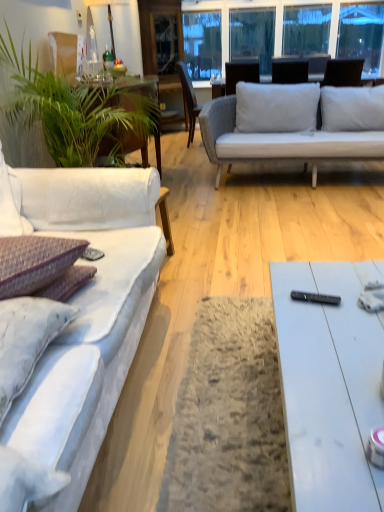
Image resolution: width=384 pixels, height=512 pixels. Find the location of `vacant area that is situated to the right of black plastic remote control at center`. vacant area that is situated to the right of black plastic remote control at center is located at coordinates (353, 296).